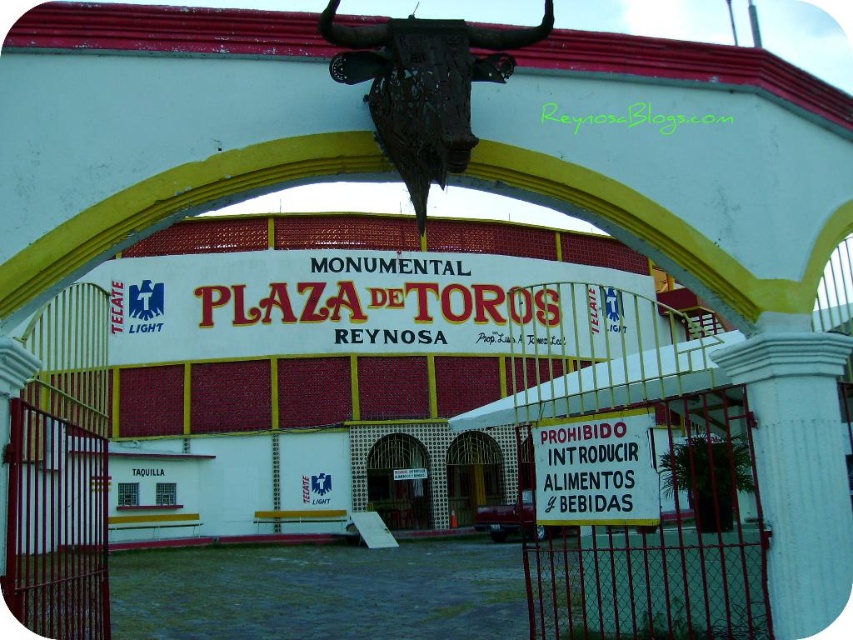
You are a tour guide explaining the entrance to visitors. You point to the white paper sign at center and the metallic gate at center. Which object is narrower?

The white paper sign at center is narrower than the metallic gate at center.

You are standing at the entrance of the Monumental Plaza de Toros in Reynosa. You see a white paper sign at center and a white metal gate at center. Which object is smaller in size?

The white paper sign at center is smaller in size compared to the white metal gate at center.